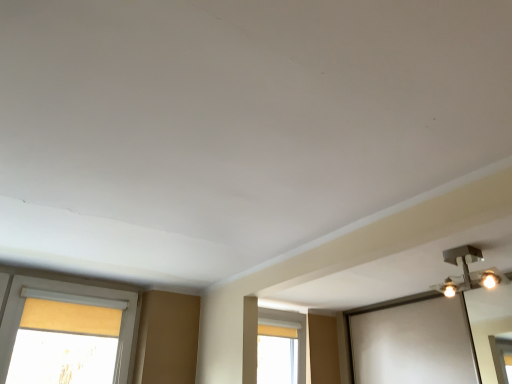
Question: From the image's perspective, is metallic silver light fixture at upper right on top of matte yellow curtain at center?

Choices:
 (A) yes
 (B) no

Answer: (A)

Question: Could you tell me if metallic silver light fixture at upper right is turned towards matte yellow curtain at center?

Choices:
 (A) yes
 (B) no

Answer: (B)

Question: Are metallic silver light fixture at upper right and matte yellow curtain at center far apart?

Choices:
 (A) no
 (B) yes

Answer: (B)

Question: From the image's perspective, is metallic silver light fixture at upper right beneath matte yellow curtain at center?

Choices:
 (A) yes
 (B) no

Answer: (B)

Question: Does metallic silver light fixture at upper right lie behind matte yellow curtain at center?

Choices:
 (A) yes
 (B) no

Answer: (B)

Question: Is metallic silver light fixture at upper right with matte yellow curtain at center?

Choices:
 (A) no
 (B) yes

Answer: (A)

Question: Can you confirm if matte yellow curtain at center is taller than metallic silver light fixture at upper right?

Choices:
 (A) yes
 (B) no

Answer: (A)

Question: Is metallic silver light fixture at upper right located within matte yellow curtain at center?

Choices:
 (A) no
 (B) yes

Answer: (A)

Question: Is matte yellow curtain at center outside metallic silver light fixture at upper right?

Choices:
 (A) yes
 (B) no

Answer: (A)

Question: Is matte yellow curtain at center thinner than metallic silver light fixture at upper right?

Choices:
 (A) no
 (B) yes

Answer: (B)

Question: Considering the relative positions of matte yellow curtain at center and metallic silver light fixture at upper right in the image provided, is matte yellow curtain at center in front of metallic silver light fixture at upper right?

Choices:
 (A) no
 (B) yes

Answer: (A)

Question: Could you tell me if matte yellow curtain at center is turned towards metallic silver light fixture at upper right?

Choices:
 (A) yes
 (B) no

Answer: (A)

Question: Is matte yellow curtain at center in front of or behind metallic silver light fixture at upper right in the image?

Choices:
 (A) front
 (B) behind

Answer: (B)